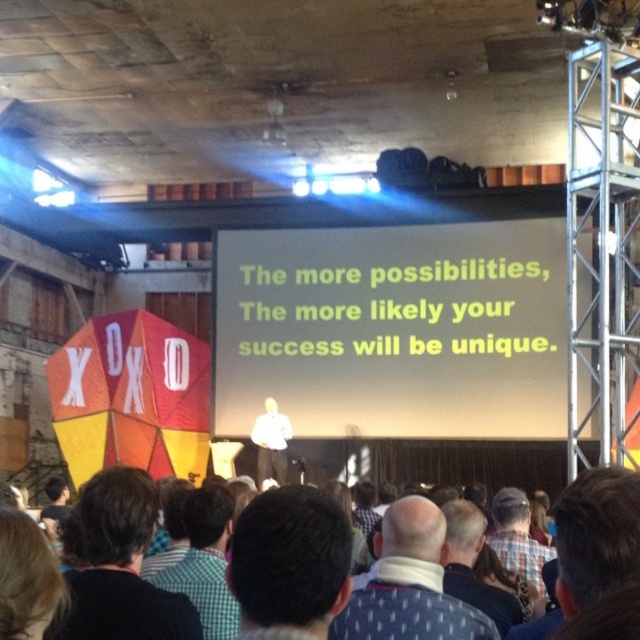
Question: Which object is positioned closest to the brown hair at center?

Choices:
 (A) white fabric at center
 (B) brown hair at lower center
 (C) white matte projection screen at center
 (D) checkered shirt at lower center

Answer: (A)

Question: Estimate the real-world distances between objects in this image. Which object is farther from the white matte projection screen at center?

Choices:
 (A) brown hair at center
 (B) blonde hair at lower left

Answer: (B)

Question: Is brown hair at center closer to camera compared to white fabric shirt at center?

Choices:
 (A) yes
 (B) no

Answer: (A)

Question: Does checkered shirt at lower center come in front of blonde hair at lower left?

Choices:
 (A) yes
 (B) no

Answer: (B)

Question: Is brown hair at lower center above checkered shirt at lower center?

Choices:
 (A) yes
 (B) no

Answer: (A)

Question: Estimate the real-world distances between objects in this image. Which object is closer to the brown hair at center?

Choices:
 (A) checkered shirt at lower center
 (B) blonde hair at lower left

Answer: (B)